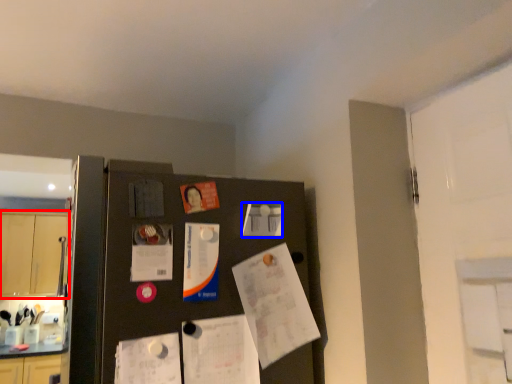
Question: Which point is further to the camera, cabinetry (highlighted by a red box) or poster (highlighted by a blue box)?

Choices:
 (A) cabinetry
 (B) poster

Answer: (A)